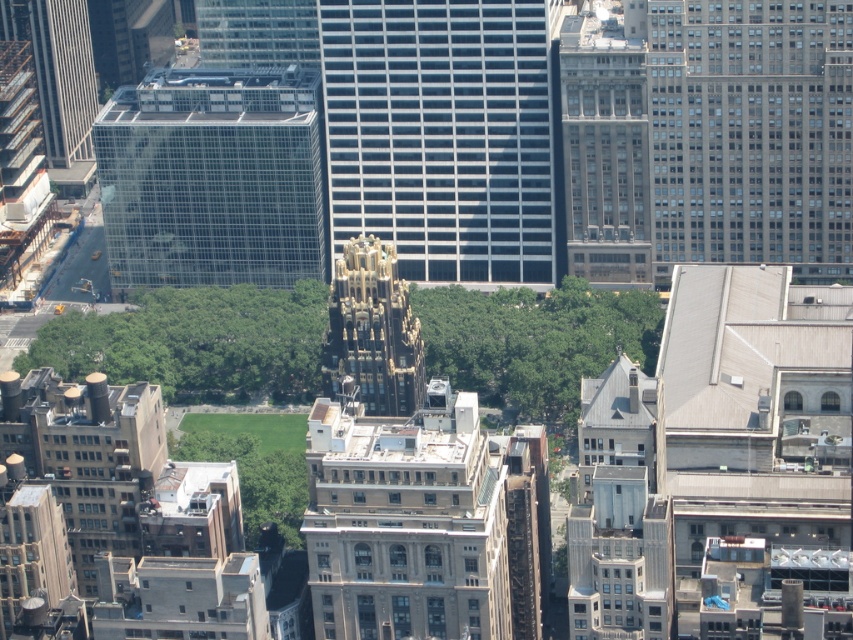
Question: Can you confirm if glassy reflective skyscraper at center is smaller than transparent glass building at upper left?

Choices:
 (A) no
 (B) yes

Answer: (B)

Question: Which of the following is the farthest from the observer?

Choices:
 (A) gold textured building at center
 (B) glassy reflective skyscraper at center

Answer: (B)

Question: Based on their relative distances, which object is farther from the transparent glass building at upper left?

Choices:
 (A) gray concrete building at upper right
 (B) gold textured building at center
 (C) gray stone building at center

Answer: (A)

Question: Does gray concrete building at upper right have a smaller size compared to gold textured building at center?

Choices:
 (A) no
 (B) yes

Answer: (A)

Question: Can you confirm if gray concrete building at upper right is positioned to the left of transparent glass building at upper left?

Choices:
 (A) no
 (B) yes

Answer: (A)

Question: Among these objects, which one is nearest to the camera?

Choices:
 (A) transparent glass building at upper left
 (B) glassy reflective skyscraper at center
 (C) gray stone building at center
 (D) gold textured building at center

Answer: (D)